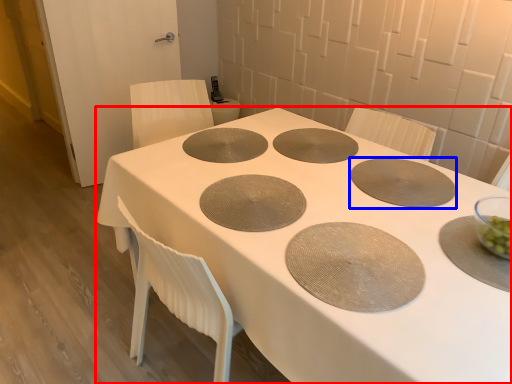
Question: Which of the following is the farthest to the observer, table (highlighted by a red box) or pizza pan (highlighted by a blue box)?

Choices:
 (A) table
 (B) pizza pan

Answer: (B)